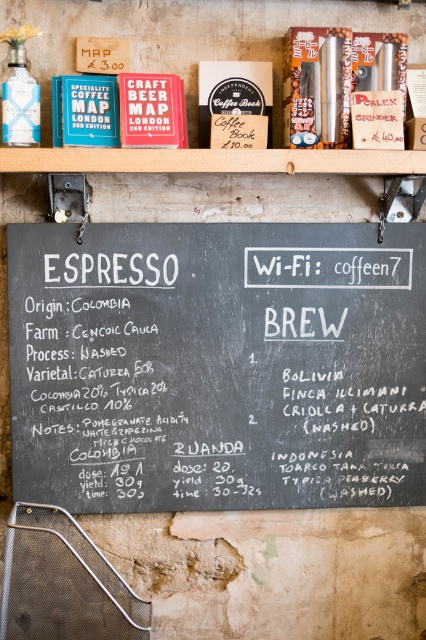
Question: Which point is closer to the camera?

Choices:
 (A) wooden at upper center
 (B) black chalkboard at center

Answer: (A)

Question: Is black chalkboard at center to the left of wooden at upper center from the viewer's perspective?

Choices:
 (A) yes
 (B) no

Answer: (B)

Question: Can you confirm if black chalkboard at center is smaller than wooden at upper center?

Choices:
 (A) no
 (B) yes

Answer: (B)

Question: Which point appears closest to the camera in this image?

Choices:
 (A) (371, 346)
 (B) (95, 10)

Answer: (B)

Question: Can you confirm if black chalkboard at center is bigger than wooden at upper center?

Choices:
 (A) yes
 (B) no

Answer: (B)

Question: Which point appears closest to the camera in this image?

Choices:
 (A) (379, 404)
 (B) (144, 13)

Answer: (B)